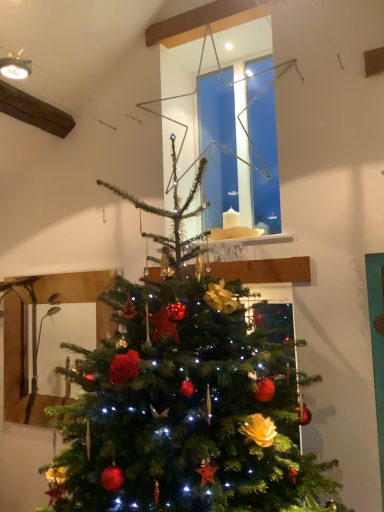
Question: Considering their positions, is metallic wire star at upper center located in front of or behind green matte christmas tree at center?

Choices:
 (A) behind
 (B) front

Answer: (A)

Question: Would you say metallic wire star at upper center is to the left or to the right of green matte christmas tree at center in the picture?

Choices:
 (A) left
 (B) right

Answer: (B)

Question: From the image's perspective, relative to green matte christmas tree at center, is metallic wire star at upper center above or below?

Choices:
 (A) below
 (B) above

Answer: (B)

Question: Is green matte christmas tree at center wider or thinner than metallic wire star at upper center?

Choices:
 (A) wide
 (B) thin

Answer: (A)

Question: Considering the relative positions of green matte christmas tree at center and metallic wire star at upper center in the image provided, is green matte christmas tree at center to the left or to the right of metallic wire star at upper center?

Choices:
 (A) left
 (B) right

Answer: (A)

Question: From a real-world perspective, is green matte christmas tree at center above or below metallic wire star at upper center?

Choices:
 (A) below
 (B) above

Answer: (A)

Question: From the image's perspective, is green matte christmas tree at center located above or below metallic wire star at upper center?

Choices:
 (A) below
 (B) above

Answer: (A)